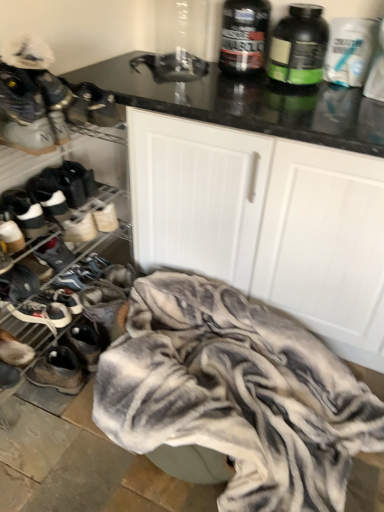
The width and height of the screenshot is (384, 512). Describe the element at coordinates (18, 284) in the screenshot. I see `matte black sneaker at left, the 5th footwear viewed from the top` at that location.

Image resolution: width=384 pixels, height=512 pixels. Describe the element at coordinates (9, 381) in the screenshot. I see `dark gray suede sneaker at lower left, acting as the eighth footwear starting from the top` at that location.

How much space does black plastic bottle at upper right, the first bottle in the left-to-right sequence, occupy vertically?

It is 10.96 inches.

Describe the element at coordinates (11, 236) in the screenshot. I see `white suede sneaker at left, arranged as the third footwear when viewed from the top` at that location.

The image size is (384, 512). I want to click on suede brown shoe at lower left, placed as the 7th footwear when sorted from top to bottom, so click(x=12, y=359).

Is white suede sneaker at left, acting as the 7th footwear starting from the bottom, closer to the viewer compared to white matte sneakers at upper left, the 1th footwear from the top?

That is False.

Does white suede sneaker at left, acting as the 7th footwear starting from the bottom, contain white matte sneakers at upper left, the ninth footwear from the bottom?

No, white matte sneakers at upper left, the ninth footwear from the bottom, is not inside white suede sneaker at left, acting as the 7th footwear starting from the bottom.

Can you tell me how much white suede sneaker at left, arranged as the third footwear when viewed from the top, and white matte sneakers at upper left, the 1th footwear from the top, differ in facing direction?

0.00135 degrees.

Is white suede sneaker at left, acting as the 7th footwear starting from the bottom, placed right next to white matte sneakers at upper left, the 1th footwear from the top?

white suede sneaker at left, acting as the 7th footwear starting from the bottom, and white matte sneakers at upper left, the 1th footwear from the top, are clearly separated.

Who is smaller, leather sneaker at lower left, the ninth footwear from the top, or matte black sneaker at left, the 5th footwear viewed from the top?

Smaller between the two is matte black sneaker at left, the 5th footwear viewed from the top.

Looking at this image, relative to matte black sneaker at left, the 5th footwear viewed from the top, is leather sneaker at lower left, the first footwear when ordered from bottom to top, in front or behind?

leather sneaker at lower left, the first footwear when ordered from bottom to top, is positioned farther from the viewer than matte black sneaker at left, the 5th footwear viewed from the top.

Based on the photo, from a real-world perspective, is leather sneaker at lower left, the first footwear when ordered from bottom to top, beneath matte black sneaker at left, marked as the fifth footwear in a bottom-to-top arrangement?

Yes.

From the image's perspective, would you say white leather sneakers at left, which is the 6th footwear in top-to-bottom order, is positioned over black plastic bottle at upper right, which is the third bottle in right-to-left order?

No, from the image's perspective, white leather sneakers at left, which is the 6th footwear in top-to-bottom order, is not over black plastic bottle at upper right, which is the third bottle in right-to-left order.

Is white leather sneakers at left, which is the 6th footwear in top-to-bottom order, facing towards black plastic bottle at upper right, the first bottle in the left-to-right sequence?

No.

From a real-world perspective, which object stands above the other?

black plastic bottle at upper right, which is the third bottle in right-to-left order, is physically above.

Who is more distant, white leather sneakers at left, placed as the fourth footwear when sorted from bottom to top, or black plastic bottle at upper right, the first bottle in the left-to-right sequence?

Positioned behind is white leather sneakers at left, placed as the fourth footwear when sorted from bottom to top.

Considering the positions of point (256, 30) and point (34, 290), is point (256, 30) closer or farther from the camera than point (34, 290)?

Point (256, 30) is positioned farther from the camera compared to point (34, 290).

Relative to matte black sneaker at left, the 5th footwear viewed from the top, is black plastic bottle at upper right, the first bottle in the left-to-right sequence, in front or behind?

Clearly, black plastic bottle at upper right, the first bottle in the left-to-right sequence, is behind matte black sneaker at left, the 5th footwear viewed from the top.

Is black plastic bottle at upper right, which is the third bottle in right-to-left order, looking in the opposite direction of matte black sneaker at left, the 5th footwear viewed from the top?

No, black plastic bottle at upper right, which is the third bottle in right-to-left order, is not facing away from matte black sneaker at left, the 5th footwear viewed from the top.

Which of these two, black plastic bottle at upper right, the first bottle in the left-to-right sequence, or matte black sneaker at left, the 5th footwear viewed from the top, stands taller?

Standing taller between the two is black plastic bottle at upper right, the first bottle in the left-to-right sequence.

Is leather sneaker at lower left, the ninth footwear from the top, located outside dark gray suede sneaker at lower left, placed as the 2th footwear when sorted from bottom to top?

Yes, leather sneaker at lower left, the ninth footwear from the top, is not within dark gray suede sneaker at lower left, placed as the 2th footwear when sorted from bottom to top.

Can you tell me how much leather sneaker at lower left, the ninth footwear from the top, and dark gray suede sneaker at lower left, acting as the eighth footwear starting from the top, differ in facing direction?

The angular difference between leather sneaker at lower left, the ninth footwear from the top, and dark gray suede sneaker at lower left, acting as the eighth footwear starting from the top, is 0.00316 degrees.

Is point (65, 388) closer or farther from the camera than point (3, 383)?

Point (65, 388) is positioned farther from the camera compared to point (3, 383).

From the image's perspective, is leather sneaker at lower left, the first footwear when ordered from bottom to top, below dark gray suede sneaker at lower left, acting as the eighth footwear starting from the top?

Indeed, from the image's perspective, leather sneaker at lower left, the first footwear when ordered from bottom to top, is shown beneath dark gray suede sneaker at lower left, acting as the eighth footwear starting from the top.

Would you say white suede sneaker at left, arranged as the third footwear when viewed from the top, is a long distance from white leather sneakers at left, placed as the fourth footwear when sorted from bottom to top?

Actually, white suede sneaker at left, arranged as the third footwear when viewed from the top, and white leather sneakers at left, placed as the fourth footwear when sorted from bottom to top, are a little close together.

Which of these two, white suede sneaker at left, acting as the 7th footwear starting from the bottom, or white leather sneakers at left, placed as the fourth footwear when sorted from bottom to top, stands taller?

Standing taller between the two is white suede sneaker at left, acting as the 7th footwear starting from the bottom.

Would you say white suede sneaker at left, acting as the 7th footwear starting from the bottom, is outside white leather sneakers at left, which is the 6th footwear in top-to-bottom order?

Yes, white suede sneaker at left, acting as the 7th footwear starting from the bottom, is located beyond the bounds of white leather sneakers at left, which is the 6th footwear in top-to-bottom order.

Are black plastic bottle at upper right, which is the third bottle in right-to-left order, and white suede sneakers at left, the second footwear when ordered from top to bottom, located far from each other?

No, there isn't a large distance between black plastic bottle at upper right, which is the third bottle in right-to-left order, and white suede sneakers at left, the second footwear when ordered from top to bottom.

Which is correct: black plastic bottle at upper right, the first bottle in the left-to-right sequence, is inside white suede sneakers at left, the second footwear when ordered from top to bottom, or outside of it?

black plastic bottle at upper right, the first bottle in the left-to-right sequence, is not enclosed by white suede sneakers at left, the second footwear when ordered from top to bottom.

Is black plastic bottle at upper right, the first bottle in the left-to-right sequence, further to the viewer compared to white suede sneakers at left, which is the 8th footwear from bottom to top?

Yes, it is.

Based on the photo, from the image's perspective, would you say black plastic bottle at upper right, the first bottle in the left-to-right sequence, is positioned over white suede sneakers at left, which is the 8th footwear from bottom to top?

Yes, from the image's perspective, black plastic bottle at upper right, the first bottle in the left-to-right sequence, is above white suede sneakers at left, which is the 8th footwear from bottom to top.

Where is `the 1st footwear behind the white matte sneakers at upper left, the 1th footwear from the top, starting your count from the anchor`? the 1st footwear behind the white matte sneakers at upper left, the 1th footwear from the top, starting your count from the anchor is located at coordinates (11, 236).

From the image's perspective, count 4th footwears upward from the leather sneaker at lower left, the ninth footwear from the top, and point to it. Please provide its 2D coordinates.

[(18, 284)]

From the image, which object appears to be nearer to leather sneaker at lower left, the ninth footwear from the top, white textured blanket at lower center or white matte cabinet at center?

white textured blanket at lower center is closer to leather sneaker at lower left, the ninth footwear from the top.

When comparing their distances from dark gray suede sneaker at lower left, placed as the 2th footwear when sorted from bottom to top, does suede brown shoe at lower left, placed as the 7th footwear when sorted from top to bottom, or white matte sneakers at upper left, the 1th footwear from the top, seem closer?

suede brown shoe at lower left, placed as the 7th footwear when sorted from top to bottom.

Looking at this image, considering their positions, is white textured blanket at lower center positioned further to black plastic bottle at upper right, the first bottle in the left-to-right sequence, than dark gray suede sneaker at lower left, placed as the 2th footwear when sorted from bottom to top?

dark gray suede sneaker at lower left, placed as the 2th footwear when sorted from bottom to top, lies further to black plastic bottle at upper right, the first bottle in the left-to-right sequence, than the other object.

Looking at the image, which one is located further to matte black sneaker at left, the 5th footwear viewed from the top, suede brown shoe at lower left, placed as the 7th footwear when sorted from top to bottom, or white matte cabinet at center?

white matte cabinet at center lies further to matte black sneaker at left, the 5th footwear viewed from the top, than the other object.

Considering their positions, is black matte protein powder container at upper right, the second bottle in the right-to-left sequence, positioned further to white suede sneakers at left, which is the 8th footwear from bottom to top, than white matte sneakers at upper left, the 1th footwear from the top?

Among the two, black matte protein powder container at upper right, the second bottle in the right-to-left sequence, is located further to white suede sneakers at left, which is the 8th footwear from bottom to top.

Looking at the image, which one is located further to white suede sneakers at left, the 6th footwear in the bottom-to-top sequence, white leather sneakers at left, which is the 6th footwear in top-to-bottom order, or black matte protein powder container at upper right, acting as the 2th bottle starting from the left?

Based on the image, black matte protein powder container at upper right, acting as the 2th bottle starting from the left, appears to be further to white suede sneakers at left, the 6th footwear in the bottom-to-top sequence.

Which object lies further to the anchor point matte black sneaker at left, marked as the fifth footwear in a bottom-to-top arrangement, black plastic bottle at upper right, which is the third bottle in right-to-left order, or white textured blanket at lower center?

black plastic bottle at upper right, which is the third bottle in right-to-left order, is positioned further to the anchor matte black sneaker at left, marked as the fifth footwear in a bottom-to-top arrangement.

From the image, which object appears to be farther from white textured blanket at lower center, white suede sneakers at left, which is the 8th footwear from bottom to top, or leather sneaker at lower left, the ninth footwear from the top?

Among the two, white suede sneakers at left, which is the 8th footwear from bottom to top, is located further to white textured blanket at lower center.

Identify the location of cabinetry that lies between white matte protein powder bottle at upper right, positioned as the 1th bottle in right-to-left order, and white textured blanket at lower center from top to bottom. (265, 222).

Where is `cabinetry located between dark gray suede sneaker at lower left, placed as the 2th footwear when sorted from bottom to top, and white matte protein powder bottle at upper right, which appears as the 3th bottle when viewed from the left, in the left-right direction`? This screenshot has width=384, height=512. cabinetry located between dark gray suede sneaker at lower left, placed as the 2th footwear when sorted from bottom to top, and white matte protein powder bottle at upper right, which appears as the 3th bottle when viewed from the left, in the left-right direction is located at coordinates (265, 222).

The height and width of the screenshot is (512, 384). I want to click on cabinetry between black plastic bottle at upper right, the first bottle in the left-to-right sequence, and suede brown shoe at lower left, placed as the 7th footwear when sorted from top to bottom, vertically, so click(x=265, y=222).

The image size is (384, 512). In order to click on cabinetry between black matte protein powder container at upper right, the second bottle in the right-to-left sequence, and white textured blanket at lower center vertically in this screenshot , I will do `click(265, 222)`.